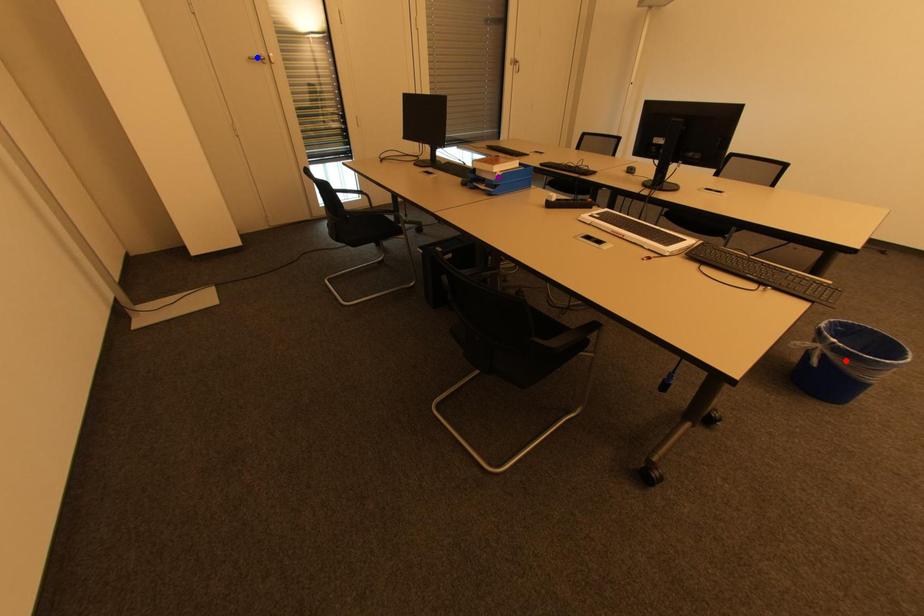
Order these from nearest to farthest:
red point, purple point, blue point

red point < purple point < blue point